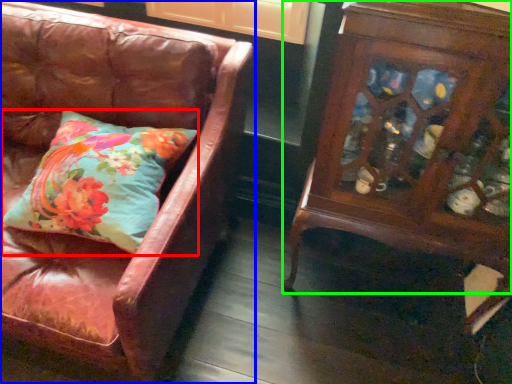
Question: Which is nearer to the pillow (highlighted by a red box)? chair (highlighted by a blue box) or furniture (highlighted by a green box).

Choices:
 (A) chair
 (B) furniture

Answer: (A)